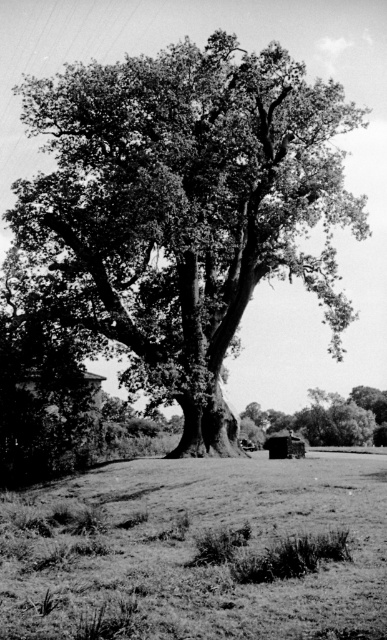
Question: Does dark green leafy oak tree at center appear on the right side of grassy field at center?

Choices:
 (A) yes
 (B) no

Answer: (B)

Question: Which object appears closest to the camera in this image?

Choices:
 (A) thick textured trunk at center
 (B) dark green leafy oak tree at center
 (C) grassy field at center

Answer: (C)

Question: Among these points, which one is nearest to the camera?

Choices:
 (A) (30, 624)
 (B) (335, 403)

Answer: (A)

Question: Is dark green leafy oak tree at center in front of grassy field at center?

Choices:
 (A) yes
 (B) no

Answer: (B)

Question: Considering the real-world distances, which object is closest to the dark green leafy oak tree at center?

Choices:
 (A) grassy field at center
 (B) thick textured trunk at center

Answer: (A)

Question: Is grassy field at center above thick textured trunk at center?

Choices:
 (A) no
 (B) yes

Answer: (B)